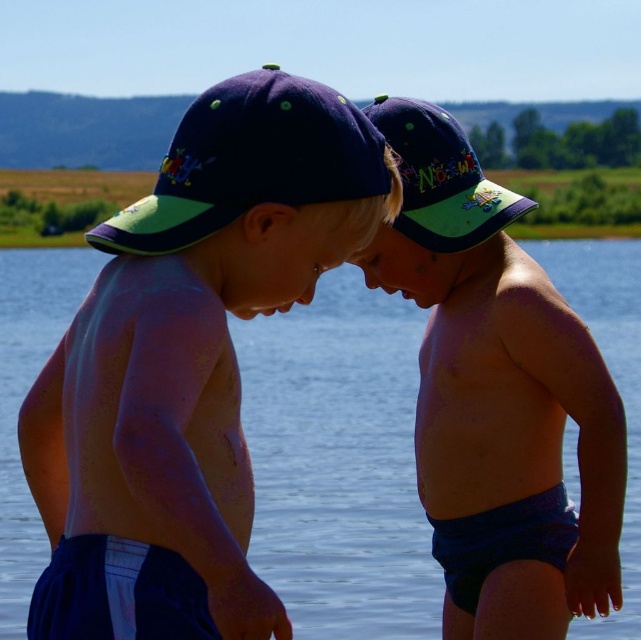
Can you confirm if transparent blue water at center is positioned to the left of matte blue cap at center?

Yes, transparent blue water at center is to the left of matte blue cap at center.

Does point (12, 356) lie behind point (437, 180)?

That is True.

Is point (340, 419) positioned after point (458, 154)?

Yes, point (340, 419) is behind point (458, 154).

Locate an element on the screen. This screenshot has width=641, height=640. transparent blue water at center is located at coordinates (338, 461).

Measure the distance between matte blue cap at left and camera.

They are 5.51 meters apart.

Does point (315, 172) lie behind point (22, 266)?

That is False.

Is point (390, 202) behind point (6, 282)?

No, (390, 202) is in front of (6, 282).

You are a GUI agent. You are given a task and a screenshot of the screen. Output one action in this format:
    pyautogui.click(x=<x>, y=<y>)
    Task: Click on the matte blue cap at left
    The width and height of the screenshot is (641, 640).
    Given the screenshot: What is the action you would take?
    pyautogui.click(x=188, y=362)

Is point (244, 77) less distant than point (438, 220)?

Yes, it is.

In order to click on matte blue cap at left in this screenshot , I will do `click(188, 362)`.